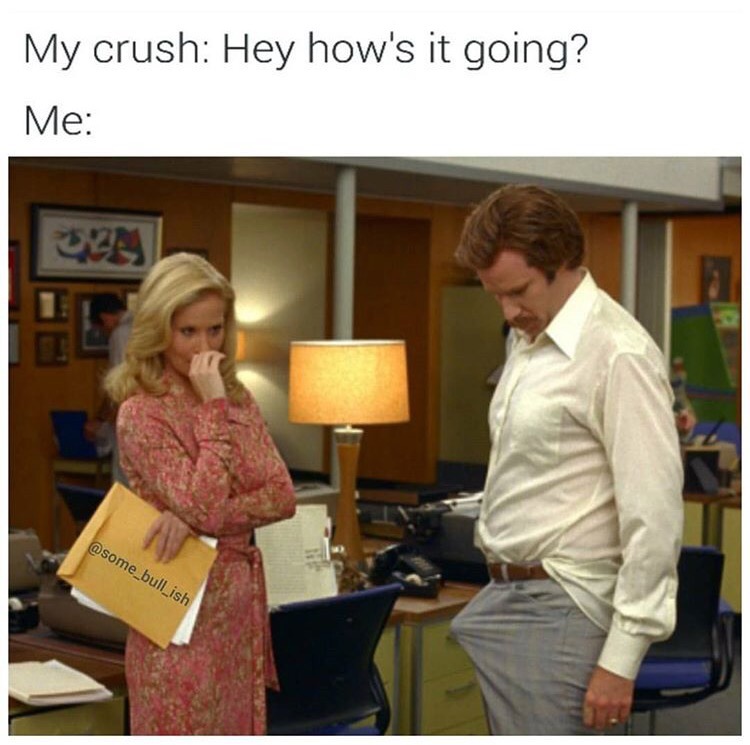
The height and width of the screenshot is (745, 750). I want to click on brown lamp, so click(x=350, y=501).